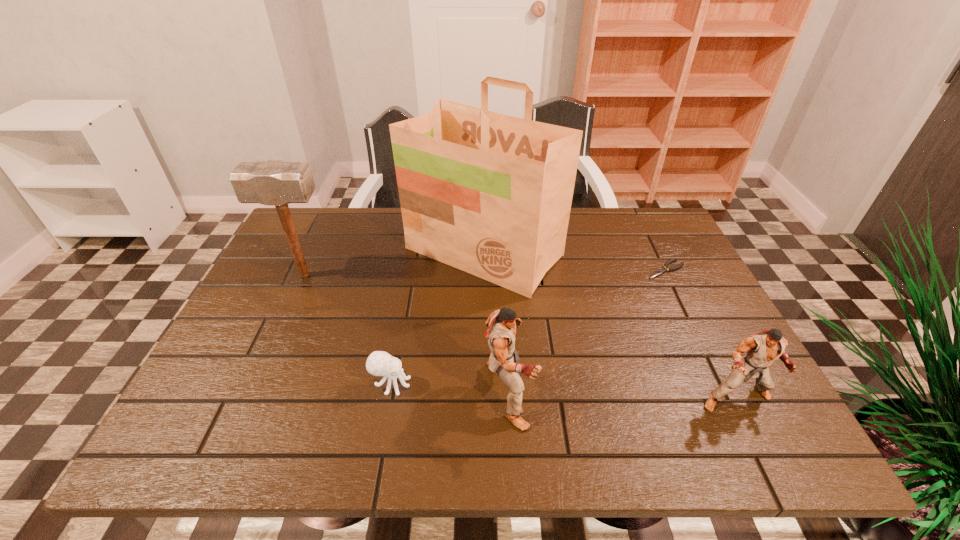
The width and height of the screenshot is (960, 540). Identify the location of empty location between the tallest object and the shorter puncher. (610, 326).

You are a GUI agent. You are given a task and a screenshot of the screen. Output one action in this format:
    pyautogui.click(x=<x>, y=<y>)
    Task: Click on the empty space between the octopus and the pliers
    The height and width of the screenshot is (540, 960).
    Given the screenshot: What is the action you would take?
    pyautogui.click(x=528, y=327)

Identify the location of blank region between the second tallest object and the shorter puncher. (520, 337).

At what (x,y) coordinates should I click in order to perform the action: click on free area in between the octopus and the shorter puncher. Please return your answer as a coordinate pair (x, y). Image resolution: width=960 pixels, height=540 pixels. Looking at the image, I should click on point(564,391).

Find the location of `object that ranks as the second closest to the third shortest object`. object that ranks as the second closest to the third shortest object is located at coordinates (489, 194).

Find the location of a particular element. This screenshot has height=540, width=960. object that is the closest one to the octopus is located at coordinates (504, 359).

Find the location of a particular element. The width and height of the screenshot is (960, 540). free spot that satisfies the following two spatial constraints: 1. on the front side of the pliers; 2. on the striking face of the fifth shortest object is located at coordinates (668, 275).

You are a GUI agent. You are given a task and a screenshot of the screen. Output one action in this format:
    pyautogui.click(x=<x>, y=<y>)
    Task: Click on the vacant area that satisfies the following two spatial constraints: 1. on the front side of the grocery bag; 2. on the striking face of the mallet
    
    Given the screenshot: What is the action you would take?
    pyautogui.click(x=484, y=275)